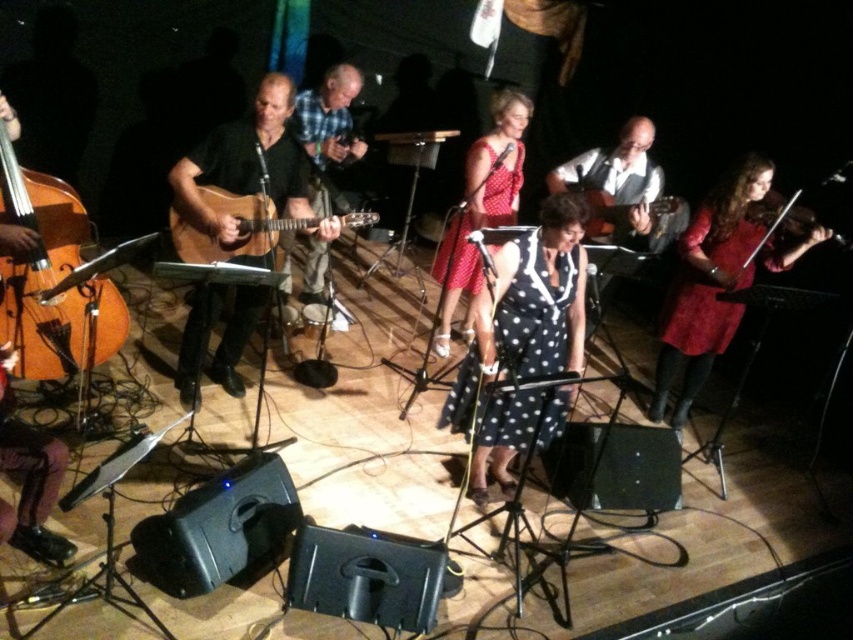
You are standing on the stage and see two points marked on the floor at point (543, 241) and point (67, 209). Which point is closer to the back of the stage?

Point (543, 241) is behind point (67, 209), so it is closer to the back of the stage.

You are a stagehand who needs to place a protective cover over both the matte black guitar at center and the acoustic guitar at center. Which guitar requires a larger cover?

The matte black guitar at center requires a larger cover because it is bigger than the acoustic guitar at center.